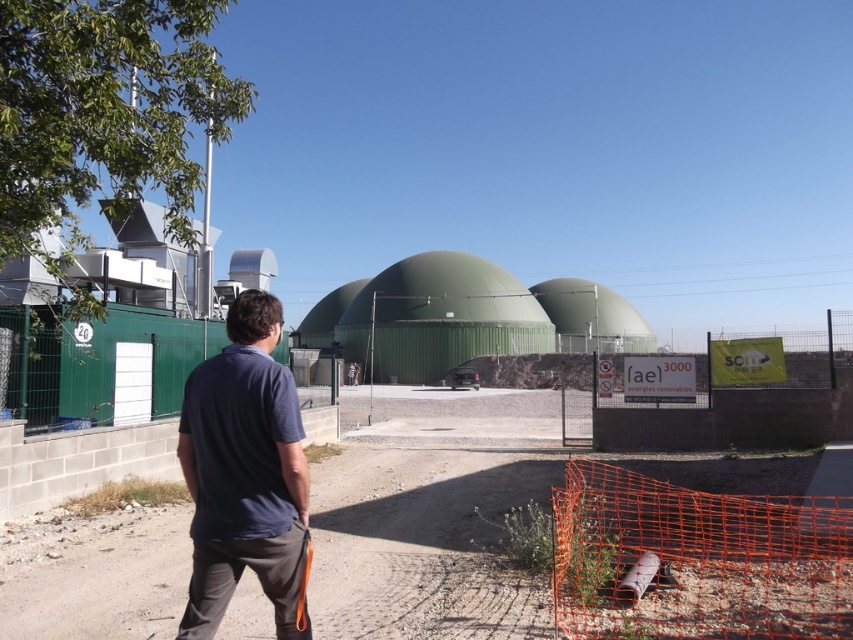
Question: Is dirt track at lower center bigger than dark blue cotton shirt at center?

Choices:
 (A) yes
 (B) no

Answer: (A)

Question: Which point is closer to the camera taking this photo?

Choices:
 (A) (425, 620)
 (B) (271, 586)

Answer: (B)

Question: Is dirt track at lower center bigger than dark blue cotton shirt at center?

Choices:
 (A) no
 (B) yes

Answer: (B)

Question: Which of the following is the closest to the observer?

Choices:
 (A) dark blue cotton shirt at center
 (B) dirt track at lower center

Answer: (A)

Question: Can you confirm if dirt track at lower center is positioned above dark blue cotton shirt at center?

Choices:
 (A) yes
 (B) no

Answer: (B)

Question: Among these points, which one is nearest to the camera?

Choices:
 (A) pyautogui.click(x=315, y=545)
 (B) pyautogui.click(x=219, y=529)

Answer: (B)